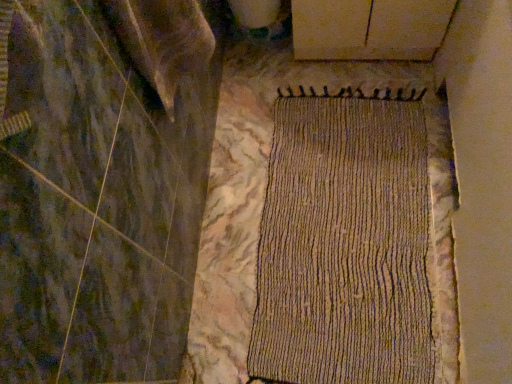
Question: From the image's perspective, is woven beige mat at center above or below smooth white plywood at upper center?

Choices:
 (A) above
 (B) below

Answer: (B)

Question: Considering their positions, is woven beige mat at center located in front of or behind smooth white plywood at upper center?

Choices:
 (A) front
 (B) behind

Answer: (A)

Question: Does point (418, 115) appear closer or farther from the camera than point (409, 19)?

Choices:
 (A) farther
 (B) closer

Answer: (A)

Question: Is smooth white plywood at upper center bigger or smaller than woven beige mat at center?

Choices:
 (A) big
 (B) small

Answer: (A)

Question: Is smooth white plywood at upper center to the left or to the right of woven beige mat at center in the image?

Choices:
 (A) right
 (B) left

Answer: (A)

Question: From a real-world perspective, is smooth white plywood at upper center positioned above or below woven beige mat at center?

Choices:
 (A) above
 (B) below

Answer: (A)

Question: Is point tap(349, 51) positioned closer to the camera than point tap(419, 347)?

Choices:
 (A) closer
 (B) farther

Answer: (B)